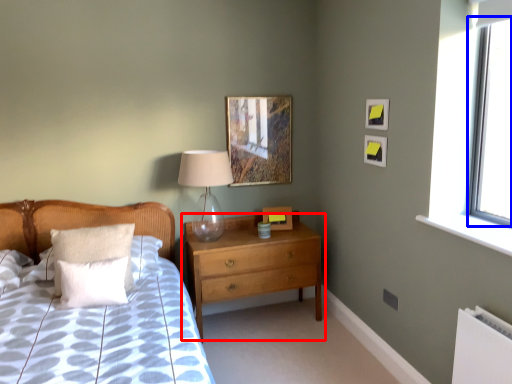
Question: Which of the following is the farthest to the observer, chest of drawers (highlighted by a red box) or window screen (highlighted by a blue box)?

Choices:
 (A) chest of drawers
 (B) window screen

Answer: (A)